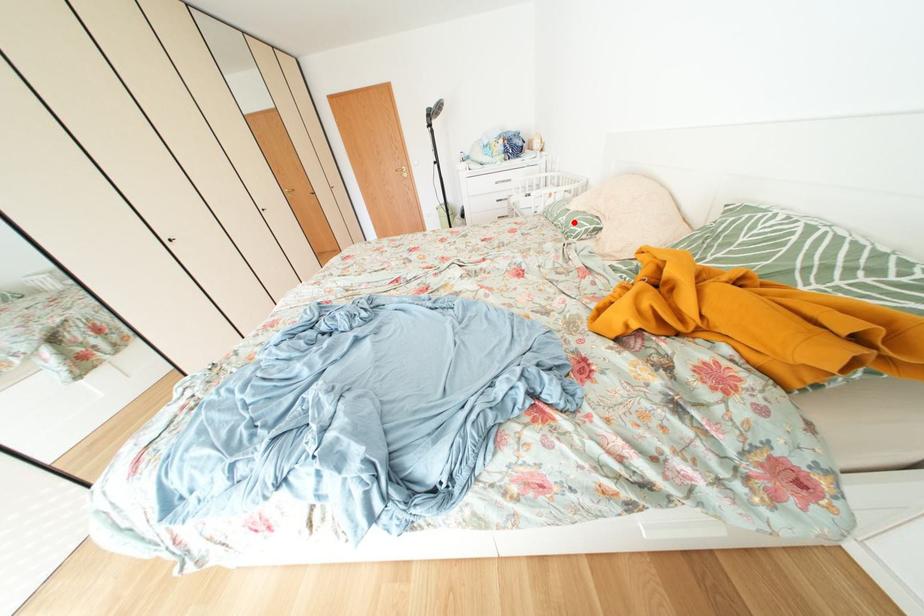
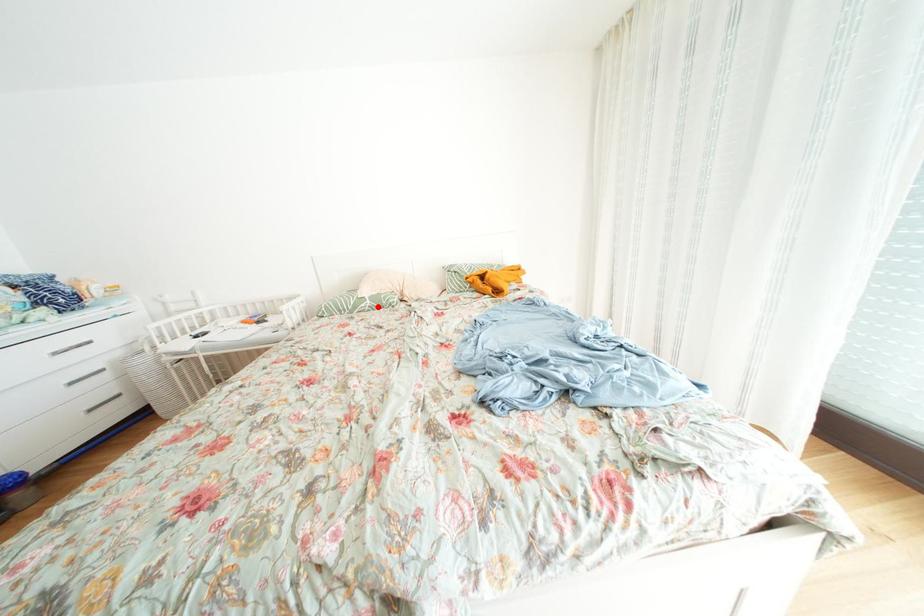
I am providing you with two images of the same scene from different viewpoints. A red point is marked on the first image and another point is marked on the second image. Are the points marked in image1 and image2 representing the same 3D position?

Yes